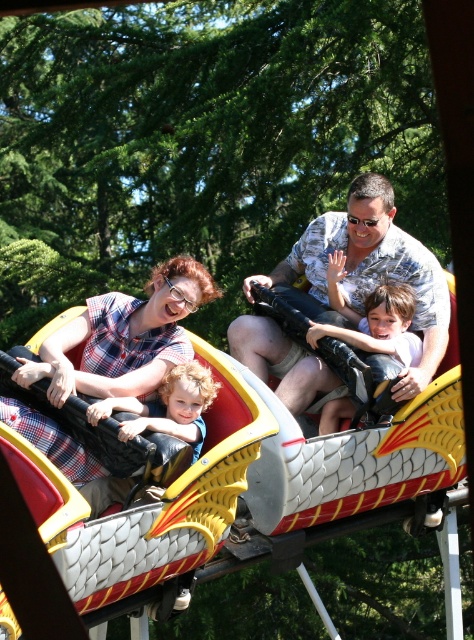
Question: Can you confirm if plaid fabric at center is positioned to the right of smooth plastic toy at center?

Choices:
 (A) yes
 (B) no

Answer: (B)

Question: Is matte gray shirt at center further to the viewer compared to smooth plastic toy at center?

Choices:
 (A) no
 (B) yes

Answer: (A)

Question: Which of these objects is positioned closest to the smooth plastic toy at center?

Choices:
 (A) plaid fabric at center
 (B) matte gray shirt at center

Answer: (B)

Question: Considering the relative positions of matte gray shirt at center and plaid fabric at center in the image provided, where is matte gray shirt at center located with respect to plaid fabric at center?

Choices:
 (A) below
 (B) above

Answer: (A)

Question: Estimate the real-world distances between objects in this image. Which object is farther from the plaid fabric at center?

Choices:
 (A) matte gray shirt at center
 (B) smooth plastic toy at center

Answer: (B)

Question: Which point appears farthest from the camera in this image?

Choices:
 (A) coord(166,332)
 (B) coord(322,307)
 (C) coord(395,301)

Answer: (B)